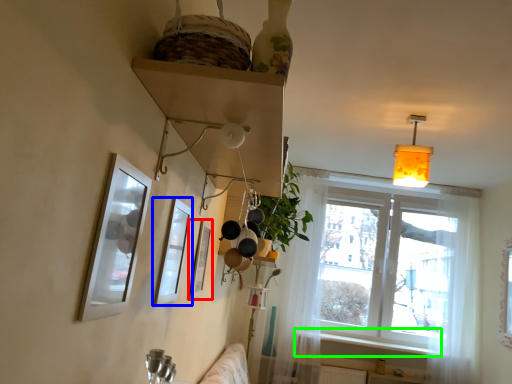
Question: Estimate the real-world distances between objects in this image. Which object is farther from picture frame (highlighted by a red box), picture frame (highlighted by a blue box) or window sill (highlighted by a green box)?

Choices:
 (A) picture frame
 (B) window sill

Answer: (B)